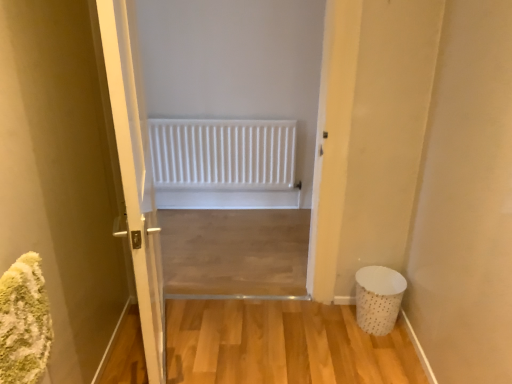
Question: Does white matte radiator at center appear on the left side of white glossy door at center?

Choices:
 (A) no
 (B) yes

Answer: (A)

Question: Is white matte radiator at center closer to camera compared to white glossy door at center?

Choices:
 (A) yes
 (B) no

Answer: (B)

Question: Is white matte radiator at center located outside white glossy door at center?

Choices:
 (A) no
 (B) yes

Answer: (B)

Question: Is white matte radiator at center wider than white glossy door at center?

Choices:
 (A) yes
 (B) no

Answer: (B)

Question: From the image's perspective, is white matte radiator at center below white glossy door at center?

Choices:
 (A) no
 (B) yes

Answer: (A)

Question: Is point (365, 279) closer or farther from the camera than point (154, 205)?

Choices:
 (A) farther
 (B) closer

Answer: (B)

Question: Considering their positions, is white dotted fabric laundry basket at lower right located in front of or behind white glossy door at center?

Choices:
 (A) front
 (B) behind

Answer: (B)

Question: From the image's perspective, relative to white glossy door at center, is white dotted fabric laundry basket at lower right above or below?

Choices:
 (A) below
 (B) above

Answer: (A)

Question: In terms of height, does white dotted fabric laundry basket at lower right look taller or shorter compared to white glossy door at center?

Choices:
 (A) tall
 (B) short

Answer: (B)

Question: Visually, is white glossy door at center positioned to the left or to the right of white matte radiator at center?

Choices:
 (A) left
 (B) right

Answer: (A)

Question: Is white glossy door at center situated inside white matte radiator at center or outside?

Choices:
 (A) inside
 (B) outside

Answer: (B)

Question: Is white glossy door at center taller or shorter than white matte radiator at center?

Choices:
 (A) tall
 (B) short

Answer: (A)

Question: From the image's perspective, relative to white matte radiator at center, is white glossy door at center above or below?

Choices:
 (A) below
 (B) above

Answer: (A)

Question: Choose the correct answer: Is white dotted fabric laundry basket at lower right inside white matte radiator at center or outside it?

Choices:
 (A) outside
 (B) inside

Answer: (A)

Question: From a real-world perspective, relative to white matte radiator at center, is white dotted fabric laundry basket at lower right vertically above or below?

Choices:
 (A) below
 (B) above

Answer: (A)